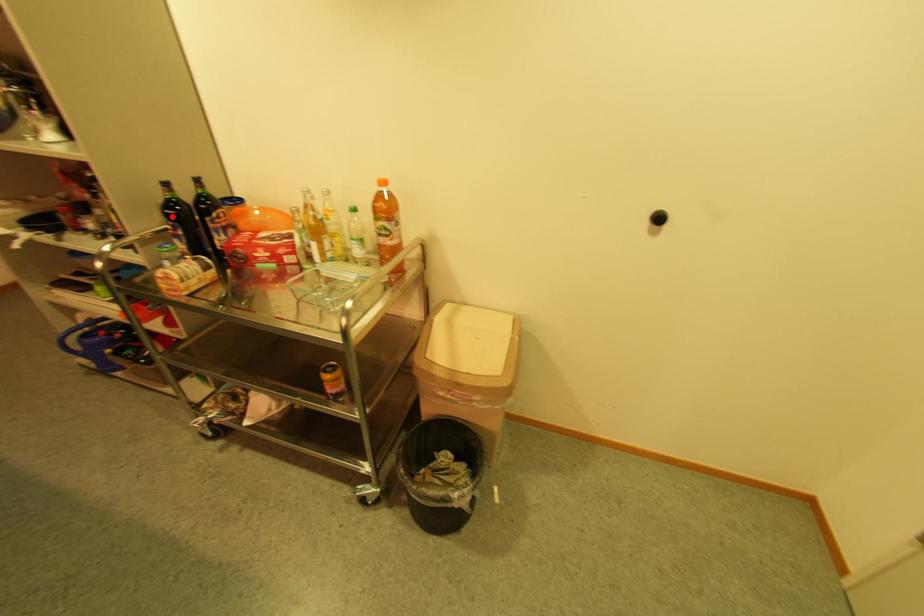
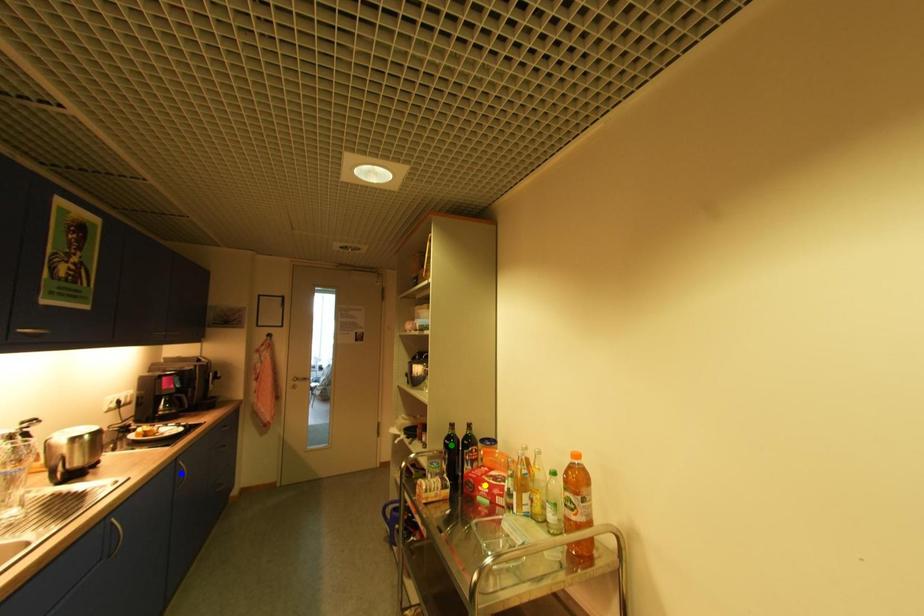
Question: I am providing you with two images of the same scene from different viewpoints. A red point is marked on the first image. You are given multiple points on the second image. Which point in image 2 is actually the same real-world point as the red point in image 1?

Choices:
 (A) yellow point
 (B) green point
 (C) blue point

Answer: (B)